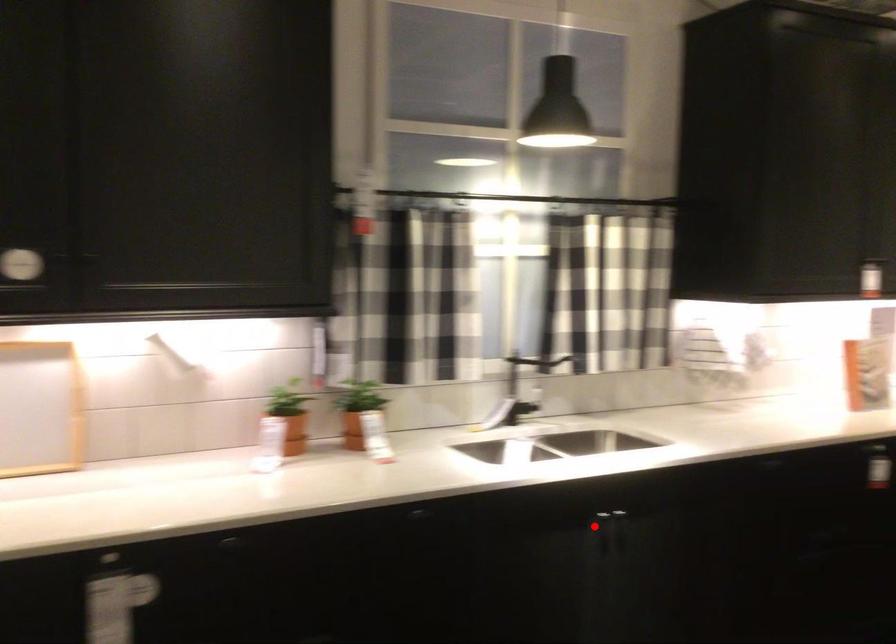
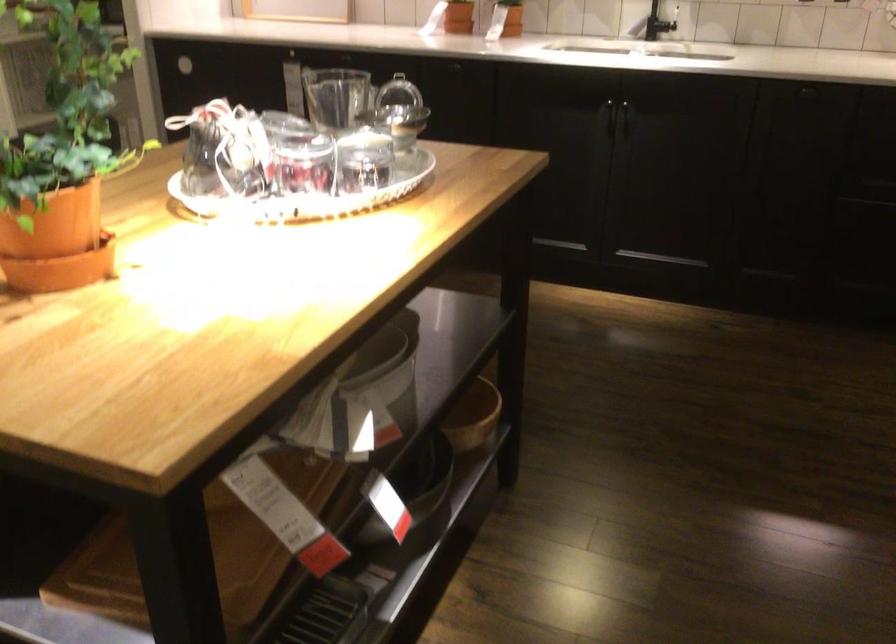
Question: I am providing you with two images of the same scene from different viewpoints. In image1, a red point is highlighted. Considering the same 3D point in image2, which of the following is correct?

Choices:
 (A) It is closer
 (B) It is farther

Answer: (B)